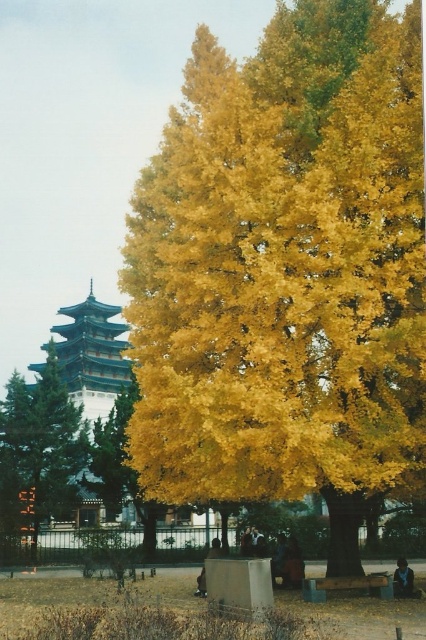
Question: Among these points, which one is nearest to the camera?

Choices:
 (A) (23, 483)
 (B) (71, 355)
 (C) (285, 497)

Answer: (C)

Question: Can you confirm if yellow/golden leafy tree at center-left is bigger than teal glossy pagoda at left?

Choices:
 (A) yes
 (B) no

Answer: (B)

Question: Which point is closer to the camera?

Choices:
 (A) golden leafy tree at center
 (B) teal glossy pagoda at left

Answer: (A)

Question: Does yellow/golden leafy tree at center-left have a smaller size compared to teal glossy pagoda at left?

Choices:
 (A) yes
 (B) no

Answer: (A)

Question: Considering the real-world distances, which object is closest to the golden leafy tree at center?

Choices:
 (A) teal glossy pagoda at left
 (B) yellow/golden leafy tree at center-left

Answer: (B)

Question: Is yellow/golden leafy tree at center-left bigger than teal glossy pagoda at left?

Choices:
 (A) yes
 (B) no

Answer: (B)